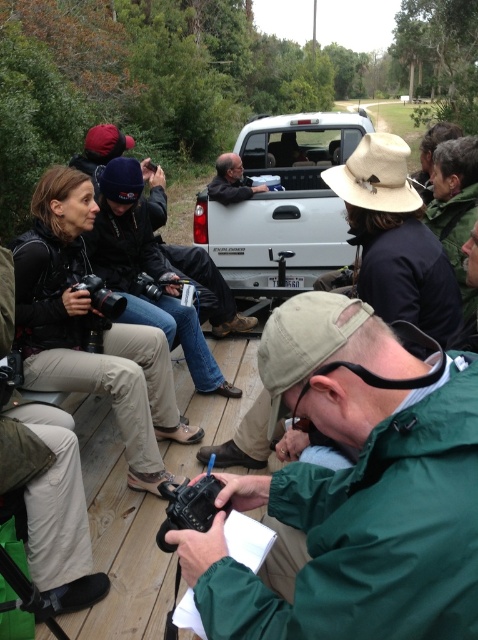
You are a photographer standing on the wooden platform and want to take a photo of the matte black shirt at center without the green matte jacket at lower right blocking the view. Is there a way to adjust your position to achieve this?

The green matte jacket at lower right is in front of the matte black shirt at center, so you can move behind the green matte jacket at lower right to capture the matte black shirt at center without obstruction.

You are a photographer who just arrived at the scene and need to place your tripod between the green matte jacket at lower right and the camera. The tripod requires a minimum of 60 centimeters of space. Is there enough space?

The distance between the green matte jacket at lower right and the camera is 64.29 centimeters, which is more than the required 60 centimeters. Therefore, there is enough space to place the tripod between them.

You are standing on the wooden platform and want to touch the green matte jacket at lower right. Is the point at coordinate (354, 490) on the green matte jacket at lower right?

Yes, the point at coordinate (354, 490) is on the green matte jacket at lower right.